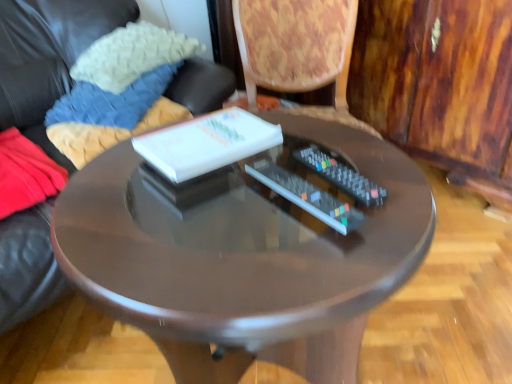
Where is `vacant space to the right of matte black remote control at center, the first remote control positioned from the left`? vacant space to the right of matte black remote control at center, the first remote control positioned from the left is located at coordinates (388, 195).